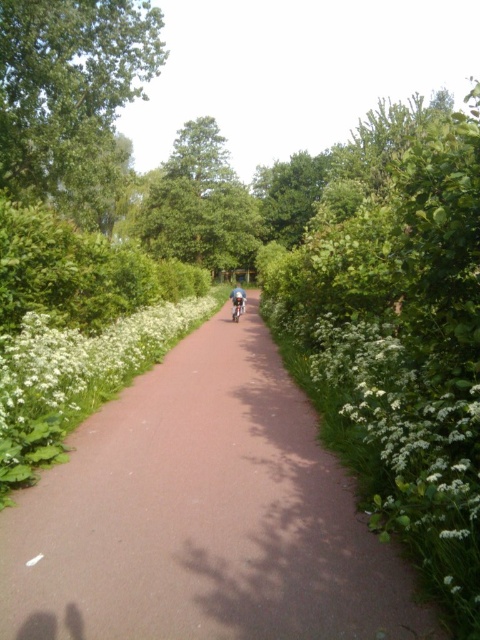
Question: In this image, where is white fluffy flowers at right located relative to white fluffy flowers at center?

Choices:
 (A) left
 (B) right

Answer: (B)

Question: Is pink asphalt trail at center thinner than shiny blue bicycle at center?

Choices:
 (A) yes
 (B) no

Answer: (B)

Question: Based on their relative distances, which object is nearer to the green leafy tree at upper left?

Choices:
 (A) green leafy tree at center
 (B) pink asphalt trail at center

Answer: (B)

Question: Among these points, which one is farthest from the camera?

Choices:
 (A) (444, 451)
 (B) (200, 186)

Answer: (B)

Question: Which object is the closest to the green leafy tree at upper left?

Choices:
 (A) green leafy tree at center
 (B) white fluffy flowers at right

Answer: (A)

Question: Considering the relative positions of white fluffy flowers at right and white fluffy flowers at center in the image provided, where is white fluffy flowers at right located with respect to white fluffy flowers at center?

Choices:
 (A) left
 (B) right

Answer: (B)